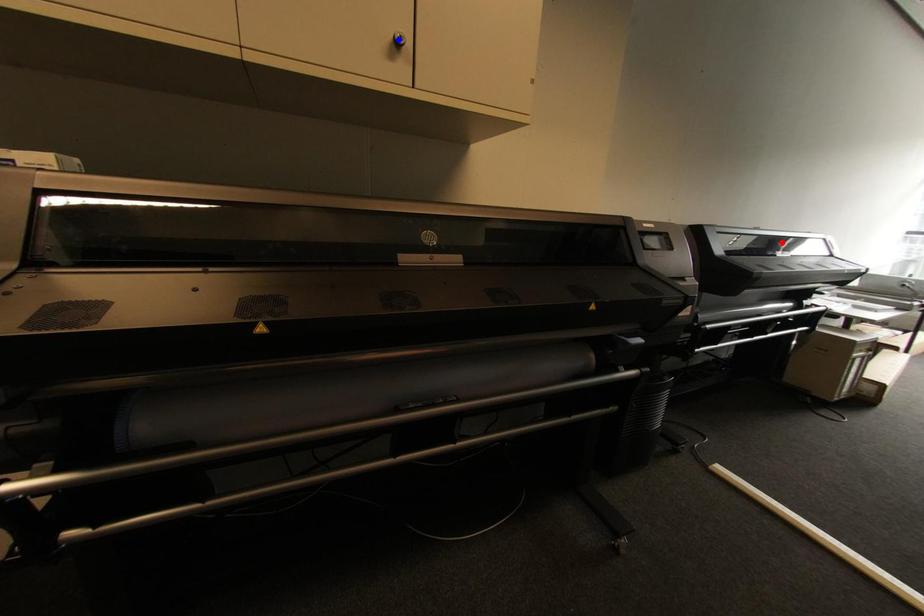
Question: Which of the two points in the image is closer to the camera?

Choices:
 (A) Blue point is closer.
 (B) Red point is closer.

Answer: (A)